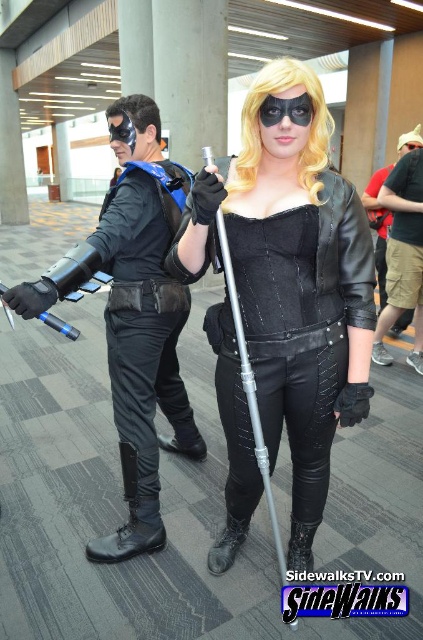
Does point (280, 83) come closer to viewer compared to point (145, 156)?

That is True.

Is black leather jacket at center wider than matte black armor at left?

Yes.

I want to click on black leather jacket at center, so click(x=291, y=278).

Where is `black leather jacket at center`? black leather jacket at center is located at coordinates 291,278.

Between matte black armor at left and black leather pants at center, which one is positioned higher?

Positioned higher is black leather pants at center.

Which is behind, point (117, 340) or point (387, 285)?

The point (387, 285) is more distant.

Identify the location of matte black armor at left. The image size is (423, 640). (134, 316).

Can you confirm if black leather jacket at center is positioned to the right of black leather pants at center?

In fact, black leather jacket at center is to the left of black leather pants at center.

Which is more to the left, black leather jacket at center or black leather pants at center?

black leather jacket at center is more to the left.

Which is in front, point (233, 401) or point (401, 164)?

Point (233, 401) is in front.

Locate an element on the screen. This screenshot has height=640, width=423. black leather jacket at center is located at coordinates (291, 278).